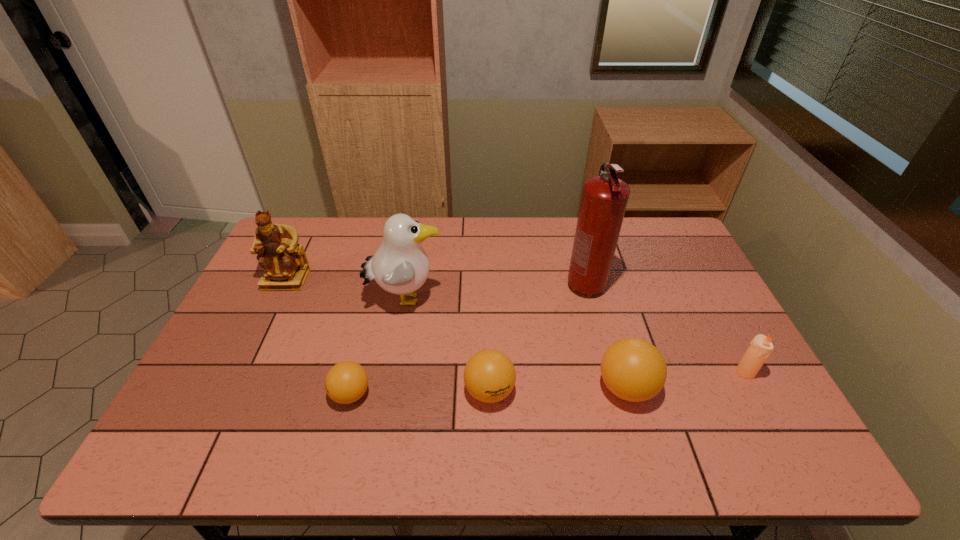
The width and height of the screenshot is (960, 540). In order to click on the leftmost ping-pong ball in this screenshot , I will do `click(346, 382)`.

Locate an element on the screen. the shortest object is located at coordinates (346, 382).

In order to click on the second shortest object in this screenshot , I will do `click(489, 375)`.

What are the coordinates of `the second tallest ping-pong ball` in the screenshot? It's located at (489, 375).

The image size is (960, 540). I want to click on the tallest ping-pong ball, so click(633, 369).

You are a GUI agent. You are given a task and a screenshot of the screen. Output one action in this format:
    pyautogui.click(x=<x>, y=<y>)
    Task: Click on the fire extinguisher
    Image resolution: width=960 pixels, height=540 pixels.
    Given the screenshot: What is the action you would take?
    pyautogui.click(x=604, y=198)

Image resolution: width=960 pixels, height=540 pixels. Find the location of `the leftmost object`. the leftmost object is located at coordinates (284, 261).

Locate an element on the screen. figurine is located at coordinates (284, 261).

Image resolution: width=960 pixels, height=540 pixels. In order to click on the second tallest object in this screenshot , I will do `click(400, 266)`.

Locate an element on the screen. This screenshot has height=540, width=960. candle is located at coordinates (760, 348).